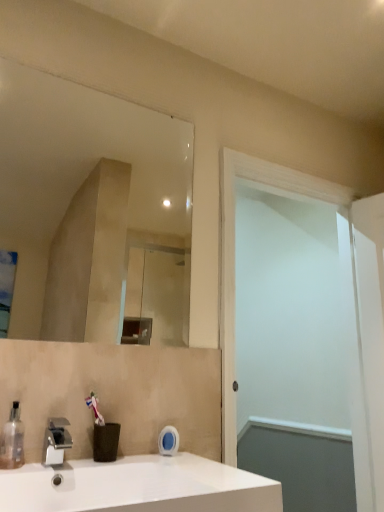
You are a GUI agent. You are given a task and a screenshot of the screen. Output one action in this format:
    pyautogui.click(x=<x>, y=<y>)
    Task: Click on the free space above clear glass mirror at upper center (from a real-world perspective)
    The image size is (384, 512).
    Given the screenshot: What is the action you would take?
    pyautogui.click(x=99, y=84)